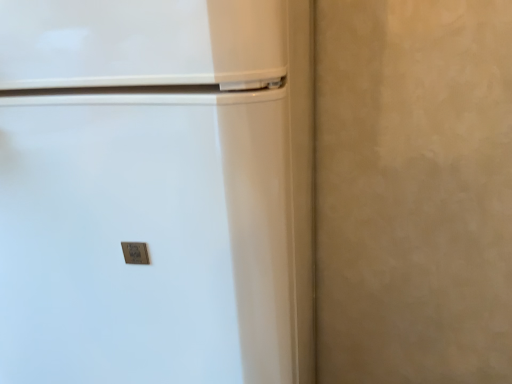
Describe the element at coordinates (156, 192) in the screenshot. I see `white glossy refrigerator at center` at that location.

Image resolution: width=512 pixels, height=384 pixels. In order to click on white glossy refrigerator at center in this screenshot , I will do 156,192.

The width and height of the screenshot is (512, 384). Find the location of `white glossy refrigerator at center`. white glossy refrigerator at center is located at coordinates (156, 192).